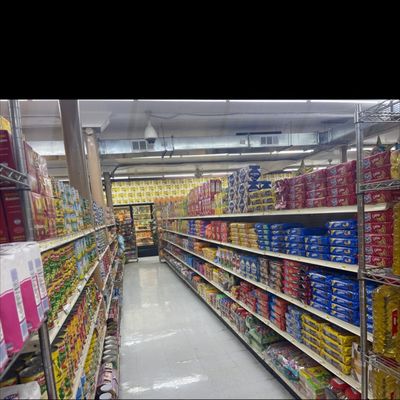
Image resolution: width=400 pixels, height=400 pixels. What are the coordinates of `ceililng` in the screenshot? It's located at (183, 106).